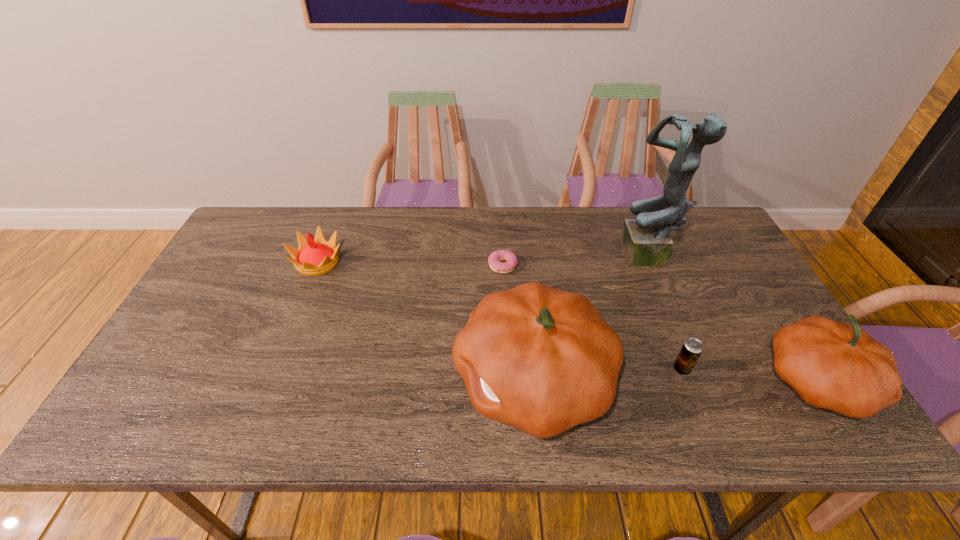
Locate an element on the screen. beer can that is at the near edge is located at coordinates (692, 348).

At what (x,y) coordinates should I click in order to perform the action: click on object that is at the right edge. Please return your answer as a coordinate pair (x, y). Looking at the image, I should click on (832, 365).

The width and height of the screenshot is (960, 540). Identify the location of object that is at the near right corner. (832, 365).

Locate an element on the screen. vacant space at the far edge is located at coordinates (400, 249).

Where is `vacant space at the near edge`? The height and width of the screenshot is (540, 960). vacant space at the near edge is located at coordinates (231, 382).

Locate an element on the screen. vacant area at the left edge of the desktop is located at coordinates (247, 299).

In the image, there is a desktop. Where is `vacant space at the right edge`? The height and width of the screenshot is (540, 960). vacant space at the right edge is located at coordinates (720, 275).

Where is `vacant area at the near left corner of the desktop`? This screenshot has width=960, height=540. vacant area at the near left corner of the desktop is located at coordinates (176, 389).

Locate an element on the screen. vacant region between the third shortest object and the doughnut is located at coordinates (411, 264).

Identify the location of free area in between the shorter pumpkin and the sculpture. Image resolution: width=960 pixels, height=540 pixels. (733, 320).